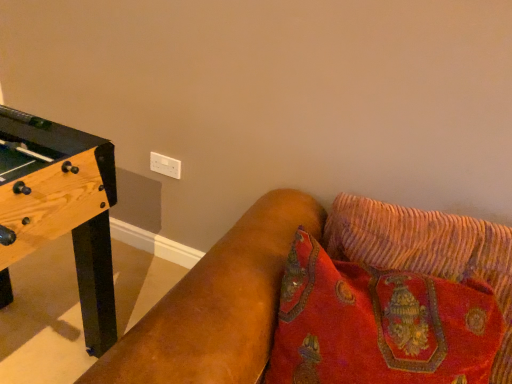
This screenshot has height=384, width=512. What do you see at coordinates (379, 324) in the screenshot?
I see `velvet red pillow at center` at bounding box center [379, 324].

Find the location of `velvet red pillow at center`. velvet red pillow at center is located at coordinates (379, 324).

Find the location of a particular element. velvet red pillow at center is located at coordinates (379, 324).